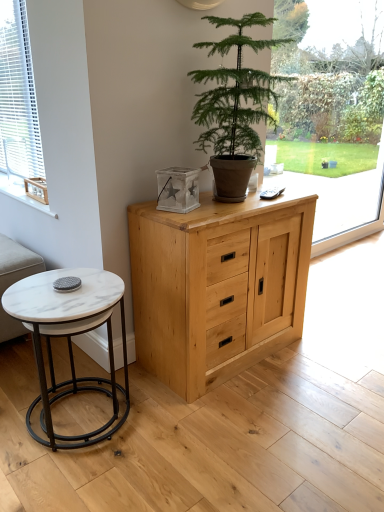
This screenshot has height=512, width=384. Describe the element at coordinates (332, 109) in the screenshot. I see `transparent glass window at center` at that location.

Locate an element on the screen. This screenshot has width=384, height=512. white marble coffee table at lower left is located at coordinates (69, 340).

Describe the element at coordinates (69, 340) in the screenshot. This screenshot has width=384, height=512. I see `white marble coffee table at lower left` at that location.

Where is `wooden crate at left`? wooden crate at left is located at coordinates (22, 193).

Consider the image. Which is correct: natural wood cabinet at center is inside transparent glass window at center, or outside of it?

natural wood cabinet at center is located beyond the bounds of transparent glass window at center.

This screenshot has width=384, height=512. I want to click on window screen that appears behind the natural wood cabinet at center, so click(x=332, y=109).

Who is shorter, natural wood cabinet at center or transparent glass window at center?

natural wood cabinet at center.

From the image's perspective, which one is positioned higher, natural wood cabinet at center or transparent glass window at center?

transparent glass window at center appears higher in the image.

Between green leafy plant at center and natural wood cabinet at center, which one is positioned behind?

natural wood cabinet at center.

Considering the positions of point (269, 22) and point (232, 283), is point (269, 22) closer or farther from the camera than point (232, 283)?

Clearly, point (269, 22) is more distant from the camera than point (232, 283).

Does green leafy plant at center have a lesser width compared to natural wood cabinet at center?

No, green leafy plant at center is not thinner than natural wood cabinet at center.

Considering the positions of objects natural wood cabinet at center and white blinds at left in the image provided, who is more to the left, natural wood cabinet at center or white blinds at left?

white blinds at left is more to the left.

Is natural wood cabinet at center facing away from white blinds at left?

Yes, natural wood cabinet at center is facing away from white blinds at left.

Find the location of a particular element. This screenshot has height=512, width=384. chest of drawers on the right of white blinds at left is located at coordinates (215, 284).

Between natural wood cabinet at center and white blinds at left, which one has more height?

white blinds at left is taller.

Which object is closer to the camera taking this photo, white blinds at left or natural wood cabinet at center?

natural wood cabinet at center is more forward.

Is natural wood cabinet at center at the back of white blinds at left?

No, white blinds at left's orientation is not away from natural wood cabinet at center.

Considering the relative sizes of white blinds at left and natural wood cabinet at center in the image provided, is white blinds at left smaller than natural wood cabinet at center?

Yes.

From a real-world perspective, who is located lower, white blinds at left or natural wood cabinet at center?

natural wood cabinet at center is physically lower.

Could you tell me if wooden crate at left is facing beige fabric couch at lower left?

No, wooden crate at left is not turned towards beige fabric couch at lower left.

Does wooden crate at left have a lesser width compared to beige fabric couch at lower left?

Indeed, wooden crate at left has a lesser width compared to beige fabric couch at lower left.

Is wooden crate at left positioned before beige fabric couch at lower left?

No, it is not.

Can you confirm if wooden crate at left is bigger than beige fabric couch at lower left?

Incorrect, wooden crate at left is not larger than beige fabric couch at lower left.

Is beige fabric couch at lower left turned away from wooden crate at left?

That's not correct — beige fabric couch at lower left is not looking away from wooden crate at left.

Is beige fabric couch at lower left touching wooden crate at left?

No, beige fabric couch at lower left is not in contact with wooden crate at left.

Can you tell me how much beige fabric couch at lower left and wooden crate at left differ in facing direction?

There is a 0.712-degree angle between the facing directions of beige fabric couch at lower left and wooden crate at left.

Who is taller, beige fabric couch at lower left or wooden crate at left?

beige fabric couch at lower left is taller.

From the image's perspective, is green leafy plant at center on beige fabric couch at lower left?

Yes, from the image's perspective, green leafy plant at center is above beige fabric couch at lower left.

Does point (198, 104) lie in front of point (32, 266)?

Yes, it is in front of point (32, 266).

Is green leafy plant at center at the right side of beige fabric couch at lower left?

Indeed, green leafy plant at center is positioned on the right side of beige fabric couch at lower left.

Locate an element on the screen. houseplant positioned vertically above the beige fabric couch at lower left (from a real-world perspective) is located at coordinates (234, 106).

Find the location of a particular element. the chest of drawers in front of the transparent glass window at center is located at coordinates (215, 284).

This screenshot has width=384, height=512. I want to click on the chest of drawers that is below the green leafy plant at center (from the image's perspective), so click(x=215, y=284).

Estimate the real-world distances between objects in this image. Which object is further from wooden crate at left, green leafy plant at center or natural wood cabinet at center?

Among the two, green leafy plant at center is located further to wooden crate at left.

From the image, which object appears to be farther from green leafy plant at center, natural wood cabinet at center or white marble coffee table at lower left?

white marble coffee table at lower left is further to green leafy plant at center.

When comparing their distances from white marble coffee table at lower left, does transparent glass window at center or wooden crate at left seem further?

The object further to white marble coffee table at lower left is transparent glass window at center.

From the picture: Estimate the real-world distances between objects in this image. Which object is closer to beige fabric couch at lower left, natural wood cabinet at center or transparent glass window at center?

natural wood cabinet at center is positioned closer to the anchor beige fabric couch at lower left.

Estimate the real-world distances between objects in this image. Which object is closer to green leafy plant at center, beige fabric couch at lower left or wooden crate at left?

wooden crate at left.

From the image, which object appears to be nearer to green leafy plant at center, white blinds at left or wooden crate at left?

white blinds at left lies closer to green leafy plant at center than the other object.

Considering their positions, is beige fabric couch at lower left positioned closer to white blinds at left than wooden crate at left?

wooden crate at left is positioned closer to the anchor white blinds at left.

Estimate the real-world distances between objects in this image. Which object is further from white blinds at left, natural wood cabinet at center or beige fabric couch at lower left?

natural wood cabinet at center is further to white blinds at left.

Where is `coffee table between wooden crate at left and transparent glass window at center in the horizontal direction`? coffee table between wooden crate at left and transparent glass window at center in the horizontal direction is located at coordinates (69, 340).

Where is `houseplant between white blinds at left and white marble coffee table at lower left in the up-down direction`? The image size is (384, 512). houseplant between white blinds at left and white marble coffee table at lower left in the up-down direction is located at coordinates (234, 106).

Where is `couch located between wooden crate at left and green leafy plant at center in the left-right direction`? couch located between wooden crate at left and green leafy plant at center in the left-right direction is located at coordinates (15, 279).

Where is `the chest of drawers that lies between white blinds at left and white marble coffee table at lower left from top to bottom`? The width and height of the screenshot is (384, 512). the chest of drawers that lies between white blinds at left and white marble coffee table at lower left from top to bottom is located at coordinates (215, 284).